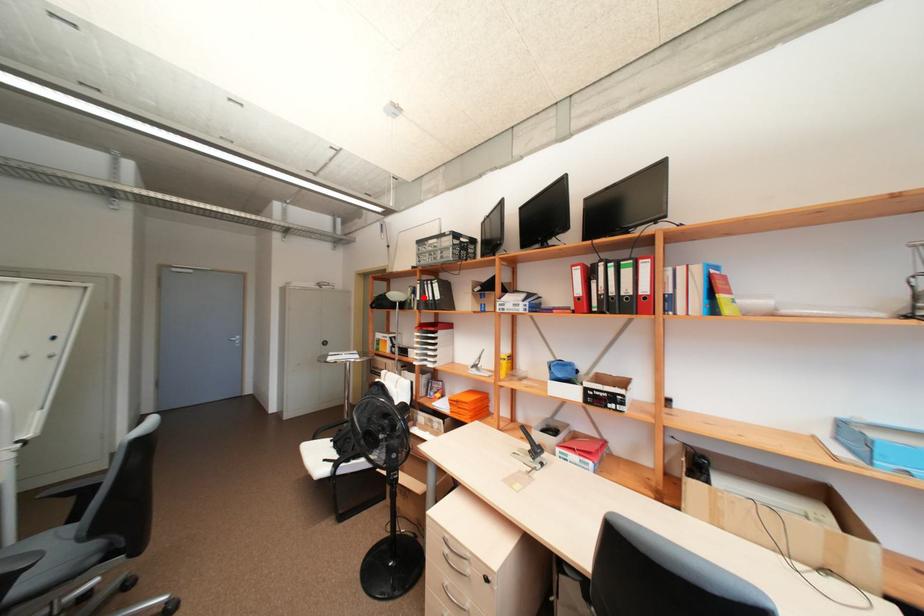
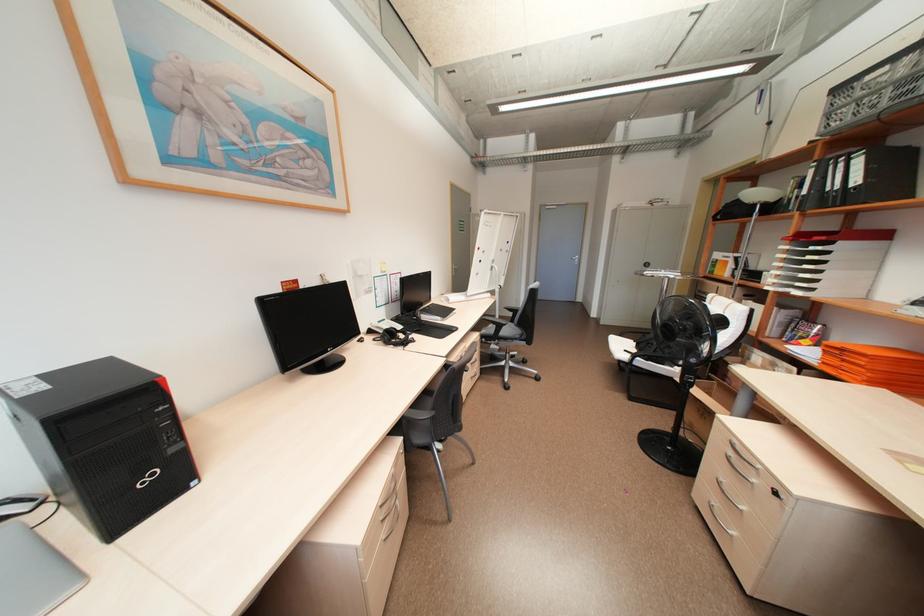
In the second image, find the point that corresponds to the highlighted location in the first image.

(810, 191)